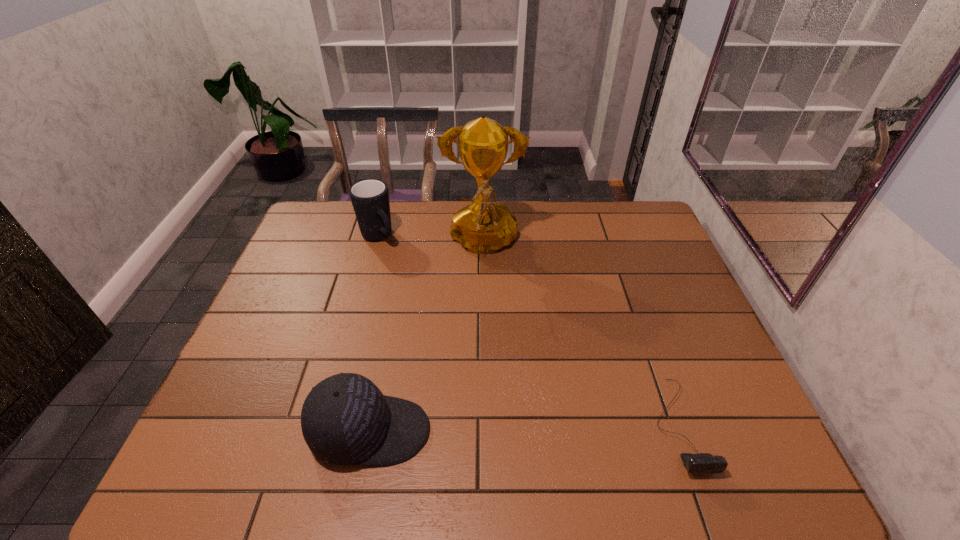
Find the location of `free location located on the side of the third shortest object with the handle`. free location located on the side of the third shortest object with the handle is located at coordinates (x=423, y=288).

Locate an element on the screen. The width and height of the screenshot is (960, 540). free region located on the side of the third shortest object with the handle is located at coordinates (395, 256).

I want to click on award situated at the far edge, so click(x=482, y=227).

The height and width of the screenshot is (540, 960). I want to click on mug at the far edge, so click(x=370, y=198).

You are a GUI agent. You are given a task and a screenshot of the screen. Output one action in this format:
    pyautogui.click(x=<x>, y=<y>)
    Task: Click on the baseball cap at the near edge
    This screenshot has width=960, height=540.
    Given the screenshot: What is the action you would take?
    point(346,420)

Locate an element on the screen. The height and width of the screenshot is (540, 960). webcam that is at the near edge is located at coordinates (x=704, y=463).

In order to click on object at the right edge in this screenshot , I will do `click(704, 463)`.

You are a GUI agent. You are given a task and a screenshot of the screen. Output one action in this format:
    pyautogui.click(x=<x>, y=<y>)
    Task: Click on the object present at the near right corner
    The width and height of the screenshot is (960, 540).
    Given the screenshot: What is the action you would take?
    pyautogui.click(x=704, y=463)

Identify the location of free space at the far edge of the desktop. The height and width of the screenshot is (540, 960). (404, 231).

Locate an element on the screen. Image resolution: width=960 pixels, height=540 pixels. vacant space at the near edge of the desktop is located at coordinates (530, 426).